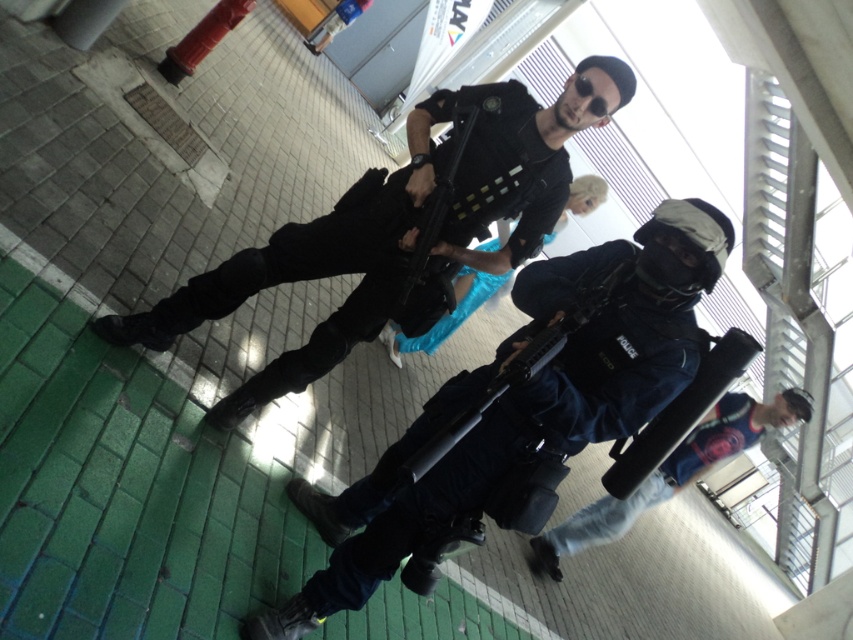
You are a photographer trying to capture a clear shot of the blue fabric bag at lower right without the matte black uniform at center blocking the view. Can you adjust your position to do so?

The matte black uniform at center is closer to the viewer than the blue fabric bag at lower right, so moving your position to the side or behind the uniform might allow you to see the blue fabric bag at lower right without obstruction.

You are a photographer trying to capture a clear image of the blue fabric bag at lower right without including the matte black uniform at center in the frame. Based on their positions, is this possible?

The matte black uniform at center is to the left of the blue fabric bag at lower right, so if you position yourself to the right side of the scene, you can capture the blue fabric bag at lower right without including the matte black uniform at center in the frame.